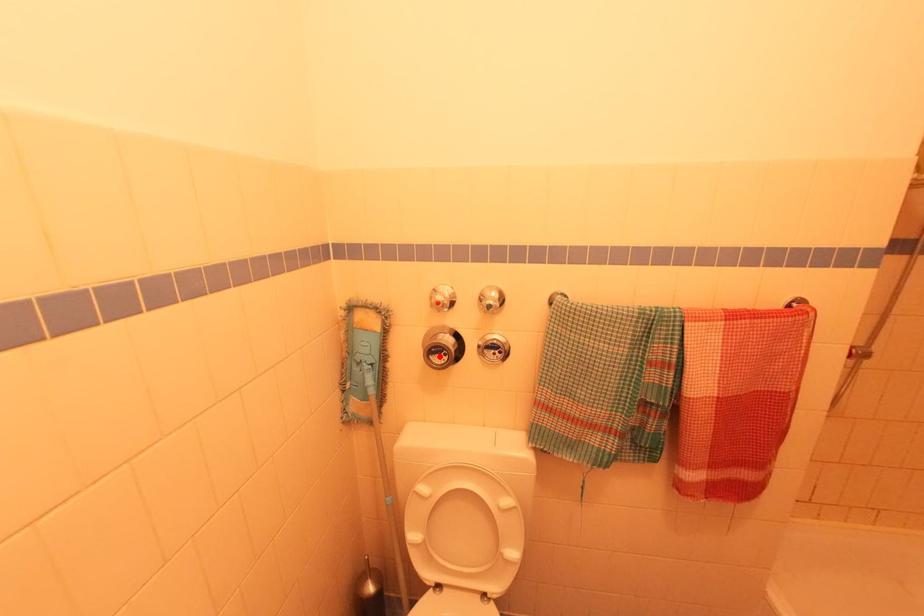
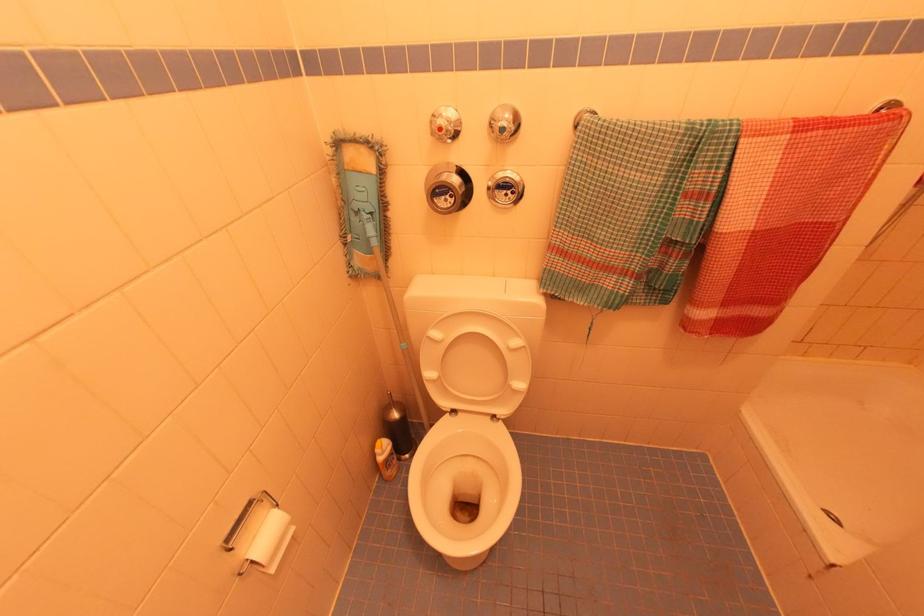
The point at the highlighted location is marked in the first image. Where is the corresponding point in the second image?

(444, 198)